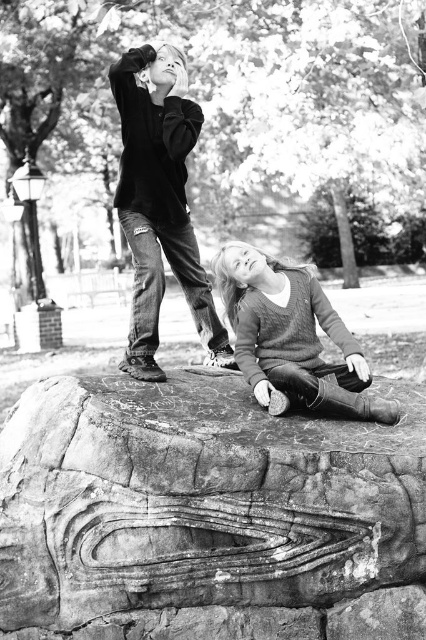
You are a photographer trying to capture a closeup shot of the child on the left. You are standing at the position of point (175, 93) and want to move towards point (164, 236) to get a better angle. Since the two points are at different distances from you, which direction should you move to get closer to the child on the left?

Point (175, 93) is closer to the viewer than point (164, 236). To get closer to the child on the left, you should move towards point (175, 93) since it is already nearer to you.

You are a photographer setting up a tripod to capture the two children in the scene. The tripod has a minimum height requirement of 30 inches to avoid blocking the camera lens. Given the distance between the rough stone carving at center and the ripped denim jeans at upper center, will the tripod be able to fit between them without obstruction?

The distance between the rough stone carving at center and the ripped denim jeans at upper center is 28.66 inches, which is less than the tripod minimum height requirement of 30 inches. Therefore, the tripod cannot fit between them without obstruction.